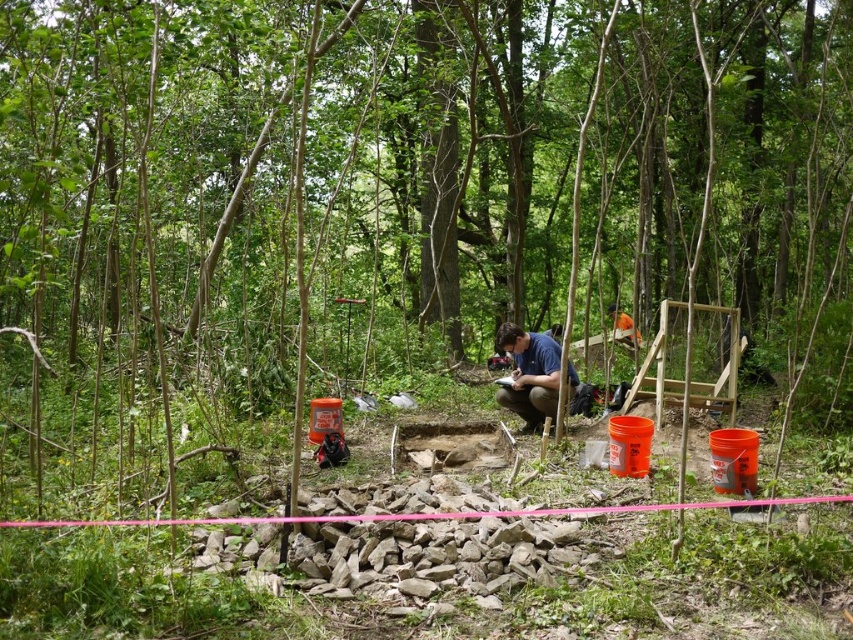
From the picture: Is blue fabric squat at center smaller than orange hard hat at center?

Yes.

The width and height of the screenshot is (853, 640). Describe the element at coordinates (531, 374) in the screenshot. I see `blue fabric squat at center` at that location.

Find the location of `blue fabric squat at center`. blue fabric squat at center is located at coordinates (531, 374).